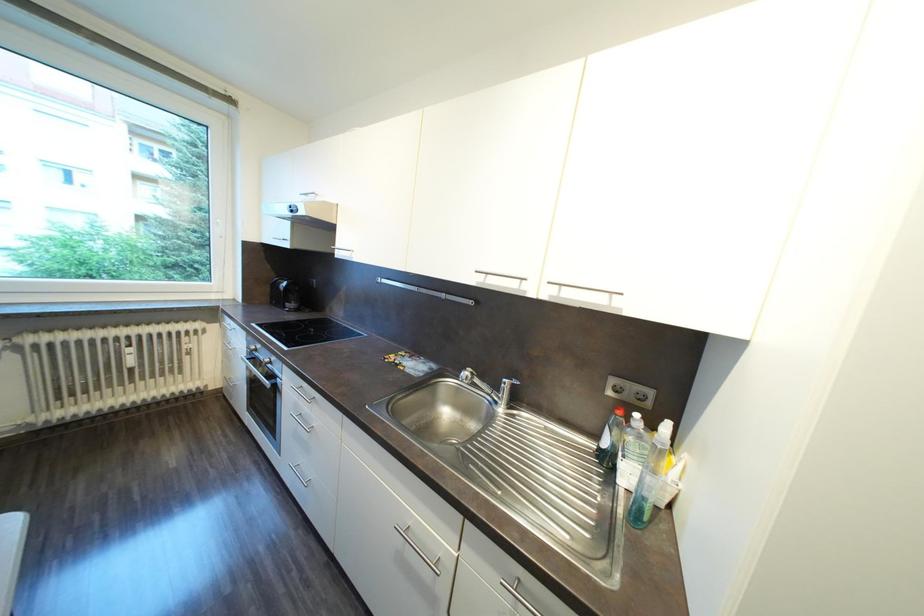
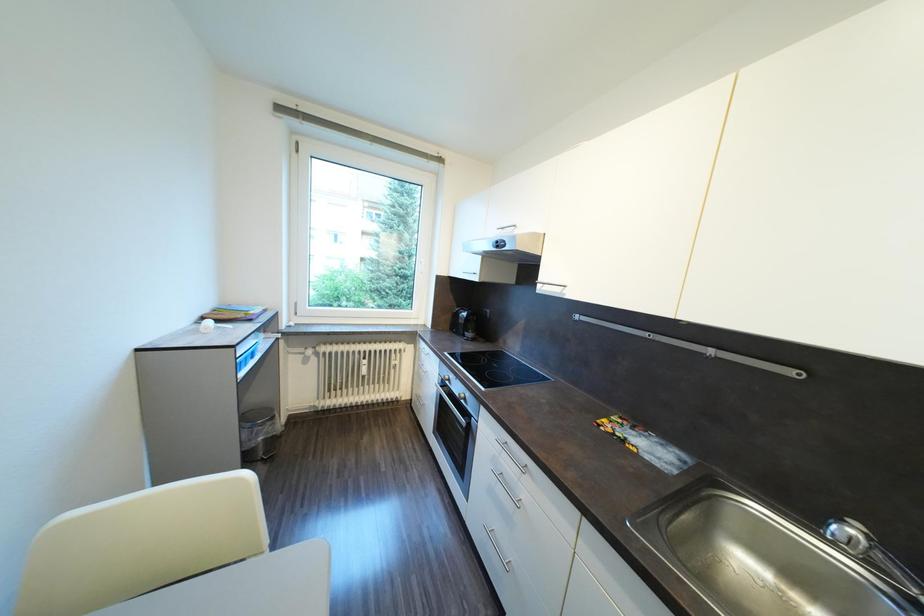
Question: In a continuous first-person perspective shot, in which direction is the camera moving?

Choices:
 (A) Left
 (B) Right
 (C) Forward
 (D) Backward

Answer: (A)